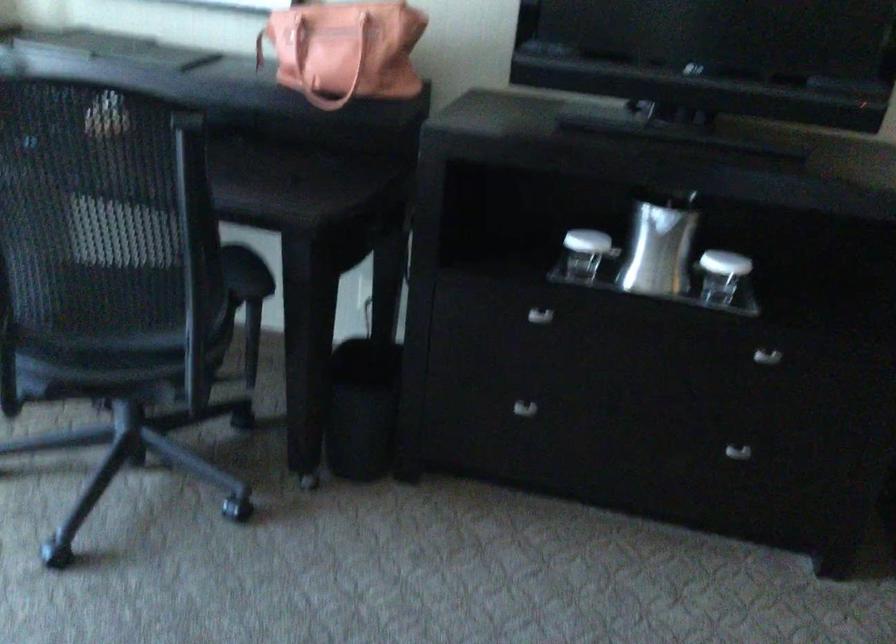
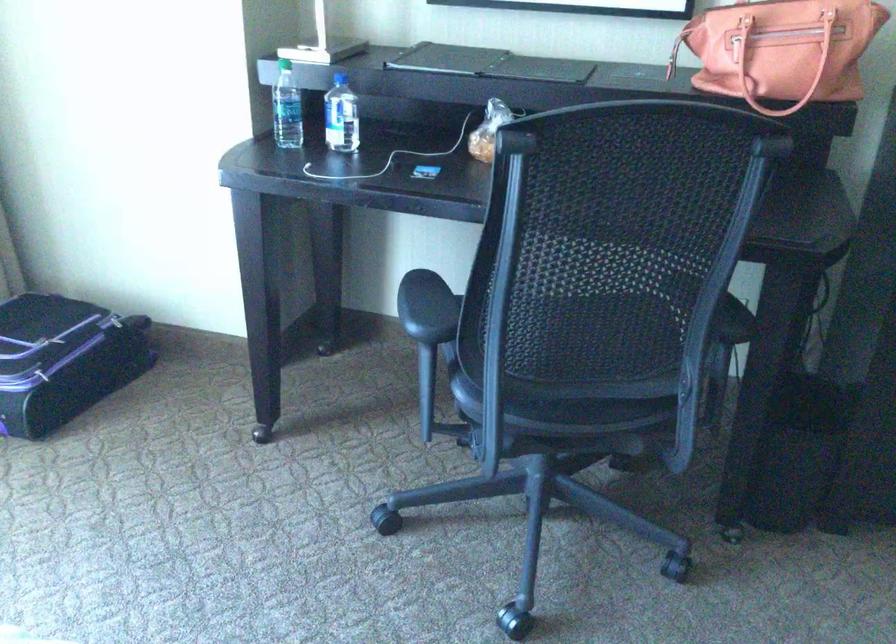
Question: Which direction would the cameraman need to move to produce the second image? Reply with the corresponding letter.

Choices:
 (A) Left
 (B) Right
 (C) Forward
 (D) Backward

Answer: (A)